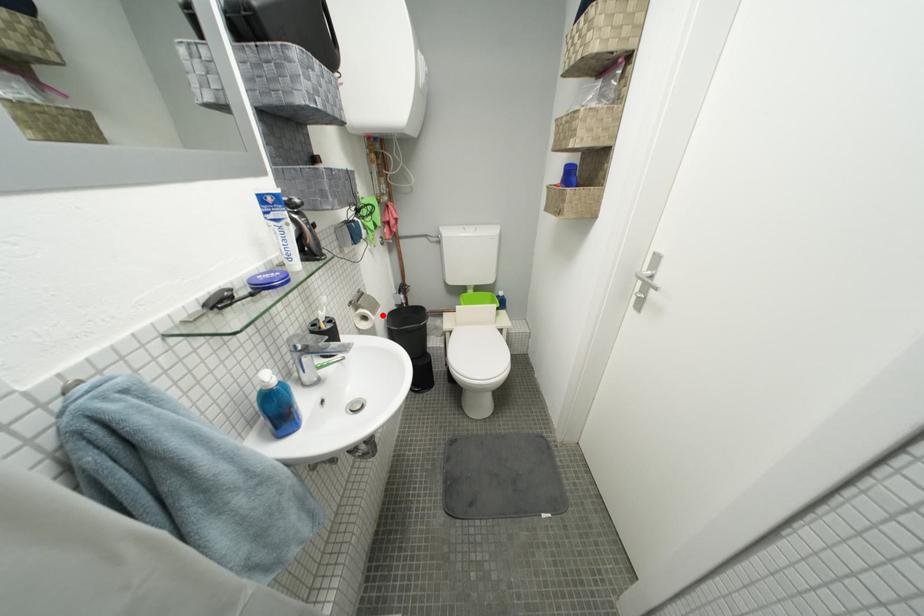
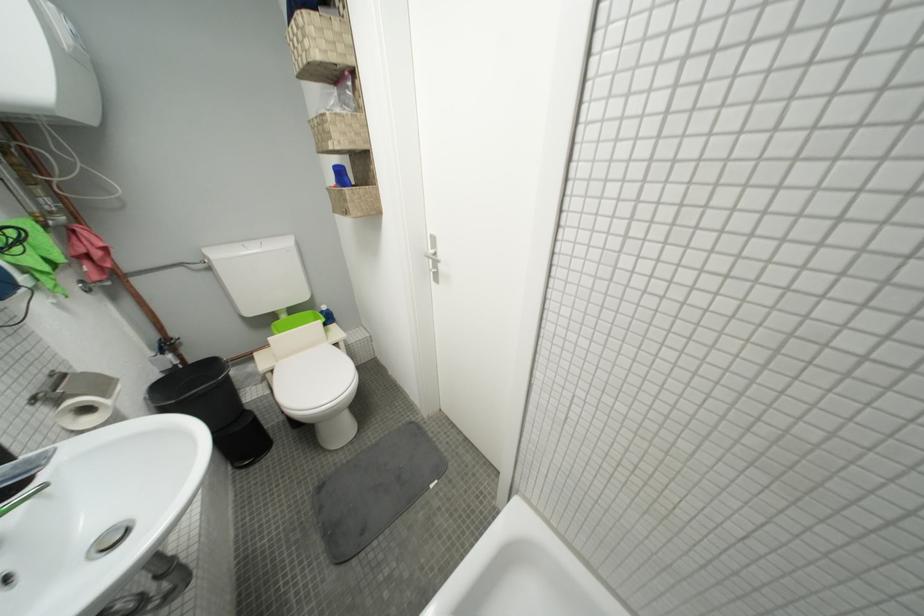
Question: I am providing you with two images of the same scene from different viewpoints. A red point is marked on the first image. Can you still see the location of the red point in image 2?

Choices:
 (A) Yes
 (B) No

Answer: (A)